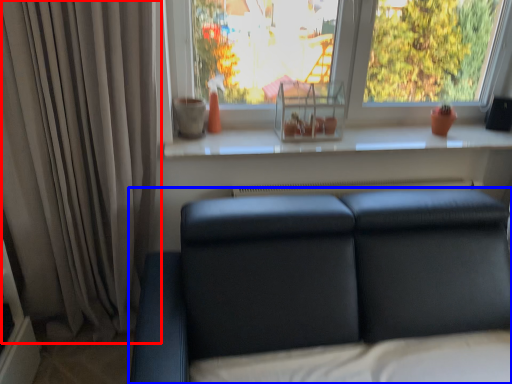
Question: Which object is closer to the camera taking this photo, curtain (highlighted by a red box) or studio couch (highlighted by a blue box)?

Choices:
 (A) curtain
 (B) studio couch

Answer: (B)